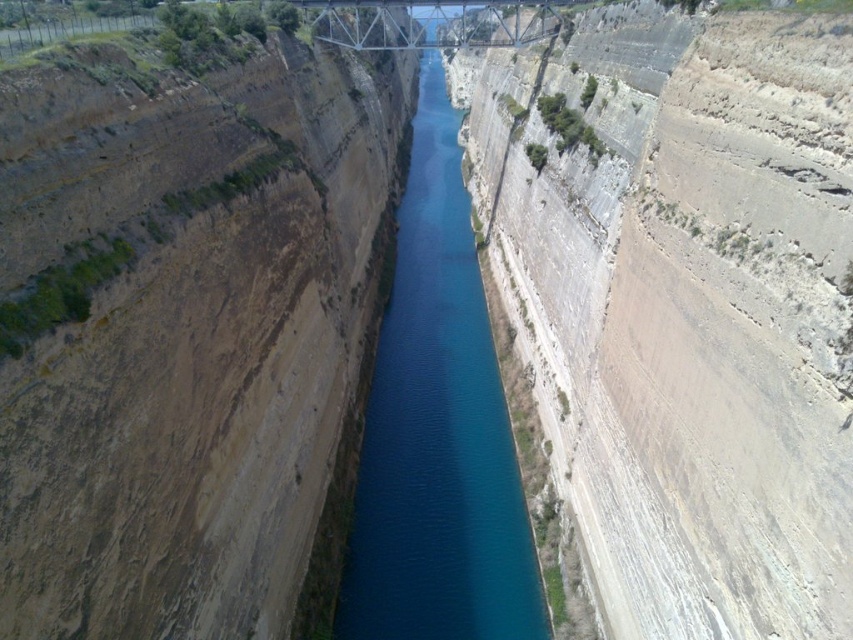
You are a photographer planning to take a wide shot of the brown rocky cliff at left and the blue smooth water at center. Which object will appear smaller in the photo?

The brown rocky cliff at left will appear smaller in the photo because it occupies less space than the blue smooth water at center.

You are a photographer planning to capture the brown rocky cliff at left and the metallic steel bridge at upper center in a single frame. Based on their sizes in the image, which object would you focus on first to ensure both are clearly visible in the photo?

The brown rocky cliff at left occupies less space than the metallic steel bridge at upper center, so you should focus on the metallic steel bridge at upper center first to ensure both objects are clearly visible in the photo.

You are a drone operator trying to navigate a small drone through the narrow canal. The drone must avoid the brown rocky cliff at left. Where is the safest path for the drone to fly through the canal?

The safest path for the drone to fly through the canal would be on the opposite side of the brown rocky cliff at left, which is located at coordinates point (184, 326). This ensures the drone avoids the cliff and navigates safely through the narrow waterway.